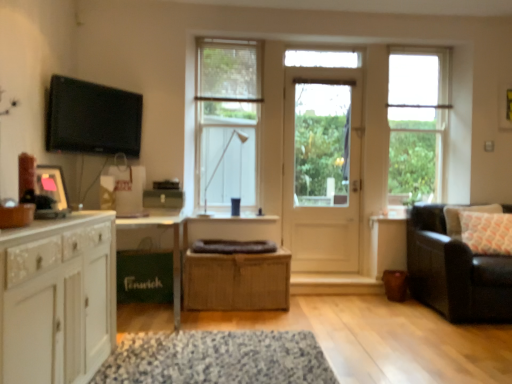
I want to click on free point above white wooden door at center (from a real-world perspective), so click(x=326, y=72).